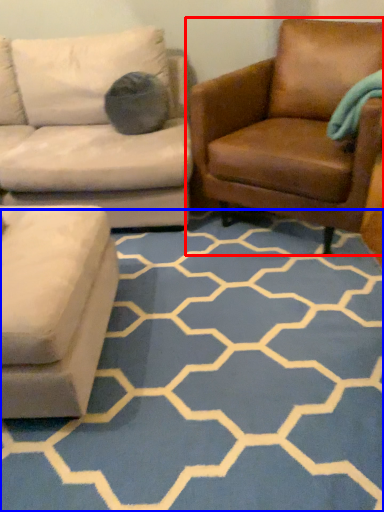
Question: Which object is further to the camera taking this photo, chair (highlighted by a red box) or pattern (highlighted by a blue box)?

Choices:
 (A) chair
 (B) pattern

Answer: (A)